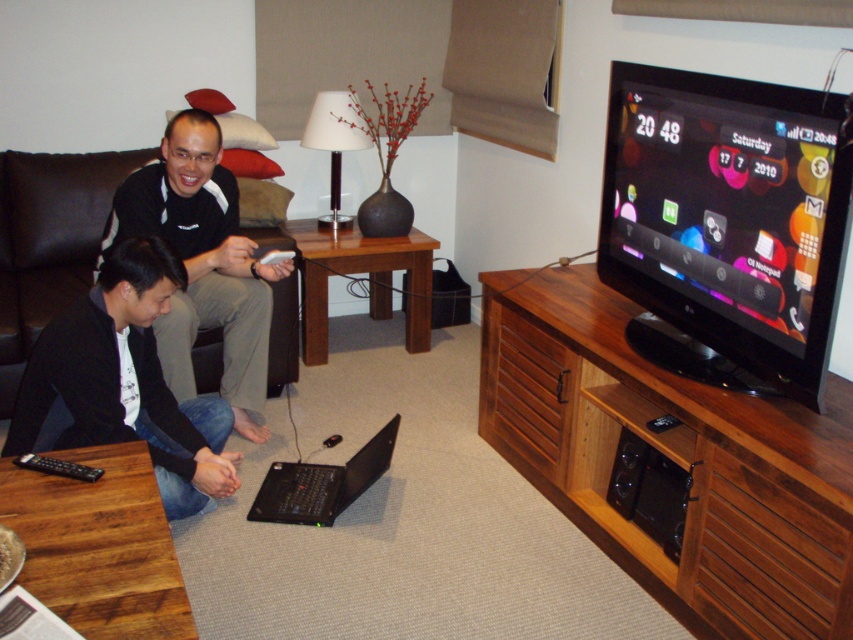
Question: Which point appears closest to the camera in this image?

Choices:
 (A) (22, 340)
 (B) (74, 468)
 (C) (730, 470)

Answer: (B)

Question: Among these objects, which one is nearest to the camera?

Choices:
 (A) black matte laptop at lower center
 (B) black plastic remote at lower left

Answer: (B)

Question: Does black matte laptop at lower center appear under black plastic remote at lower left?

Choices:
 (A) yes
 (B) no

Answer: (A)

Question: Does brown wood entertainment center at lower right have a larger size compared to black plastic remote at lower left?

Choices:
 (A) yes
 (B) no

Answer: (A)

Question: Is black matte laptop at lower center in front of black plastic remote at lower left?

Choices:
 (A) yes
 (B) no

Answer: (B)

Question: Estimate the real-world distances between objects in this image. Which object is farther from the brown leather couch at center?

Choices:
 (A) black glossy tv at upper right
 (B) brown wood entertainment center at lower right

Answer: (A)